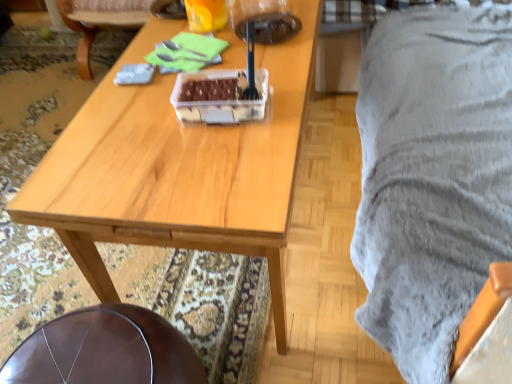
Locate an element on the screen. This screenshot has height=384, width=512. vacant space situated above leather seat at lower left, the second chair from the back (from a real-world perspective) is located at coordinates (100, 344).